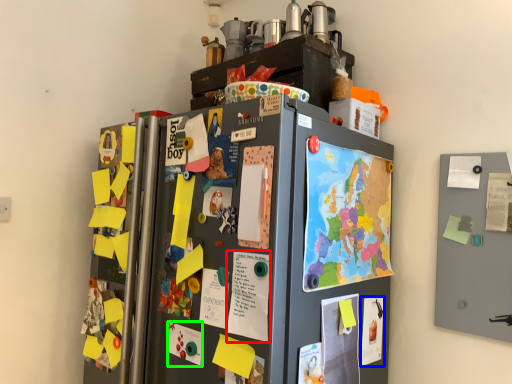
Question: Based on their relative distances, which object is farther from poster (highlighted by a red box)? Choose from poster (highlighted by a blue box) and poster (highlighted by a green box).

Choices:
 (A) poster
 (B) poster

Answer: (A)